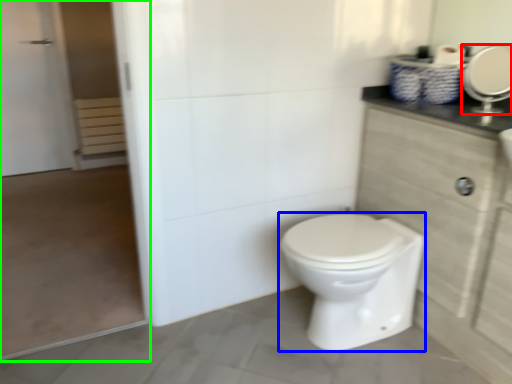
Question: Which object is the farthest from mirror (highlighted by a red box)? Choose among these: bidet (highlighted by a blue box) or screen door (highlighted by a green box).

Choices:
 (A) bidet
 (B) screen door

Answer: (B)